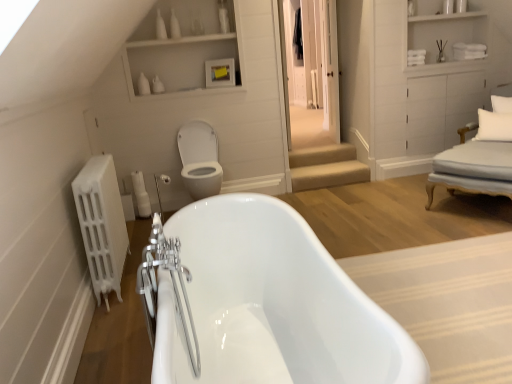
Question: Is beige carpeted stairs at center positioned beyond the bounds of white fabric armchair at right?

Choices:
 (A) no
 (B) yes

Answer: (B)

Question: Considering the relative sizes of beige carpeted stairs at center and white fabric armchair at right in the image provided, is beige carpeted stairs at center shorter than white fabric armchair at right?

Choices:
 (A) yes
 (B) no

Answer: (A)

Question: From the image's perspective, does beige carpeted stairs at center appear higher than white fabric armchair at right?

Choices:
 (A) yes
 (B) no

Answer: (B)

Question: Does beige carpeted stairs at center turn towards white fabric armchair at right?

Choices:
 (A) no
 (B) yes

Answer: (A)

Question: Considering the relative positions of beige carpeted stairs at center and white fabric armchair at right in the image provided, is beige carpeted stairs at center behind white fabric armchair at right?

Choices:
 (A) yes
 (B) no

Answer: (A)

Question: Is white fabric armchair at right inside beige carpeted stairs at center?

Choices:
 (A) no
 (B) yes

Answer: (A)

Question: Considering the relative sizes of white glossy toilet bowl at center and white wood cabinet at upper right in the image provided, is white glossy toilet bowl at center thinner than white wood cabinet at upper right?

Choices:
 (A) no
 (B) yes

Answer: (A)

Question: Is white glossy toilet bowl at center bigger than white wood cabinet at upper right?

Choices:
 (A) yes
 (B) no

Answer: (B)

Question: Is white glossy toilet bowl at center closer to the viewer compared to white wood cabinet at upper right?

Choices:
 (A) yes
 (B) no

Answer: (A)

Question: Does white glossy toilet bowl at center turn towards white wood cabinet at upper right?

Choices:
 (A) yes
 (B) no

Answer: (B)

Question: Can you confirm if white glossy toilet bowl at center is shorter than white wood cabinet at upper right?

Choices:
 (A) no
 (B) yes

Answer: (A)

Question: Considering the relative sizes of white glossy toilet bowl at center and white wood cabinet at upper right in the image provided, is white glossy toilet bowl at center wider than white wood cabinet at upper right?

Choices:
 (A) no
 (B) yes

Answer: (B)

Question: Considering the relative sizes of white fabric pillow at upper right, placed as the 1th pillow when sorted from top to bottom, and white matte radiator at left in the image provided, is white fabric pillow at upper right, placed as the 1th pillow when sorted from top to bottom, taller than white matte radiator at left?

Choices:
 (A) yes
 (B) no

Answer: (B)